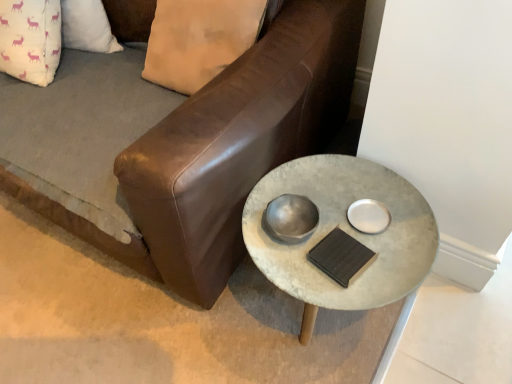
Question: Is concrete textured table at center wider than brown leather couch at center?

Choices:
 (A) no
 (B) yes

Answer: (A)

Question: Is concrete textured table at center facing away from brown leather couch at center?

Choices:
 (A) yes
 (B) no

Answer: (B)

Question: Is concrete textured table at center further to camera compared to brown leather couch at center?

Choices:
 (A) yes
 (B) no

Answer: (A)

Question: Is concrete textured table at center next to brown leather couch at center and touching it?

Choices:
 (A) no
 (B) yes

Answer: (A)

Question: From a real-world perspective, is concrete textured table at center positioned over brown leather couch at center based on gravity?

Choices:
 (A) no
 (B) yes

Answer: (B)

Question: From a real-world perspective, is concrete textured table at center positioned under brown leather couch at center based on gravity?

Choices:
 (A) no
 (B) yes

Answer: (A)

Question: Considering the relative sizes of brown leather couch at center and concrete textured table at center in the image provided, is brown leather couch at center smaller than concrete textured table at center?

Choices:
 (A) no
 (B) yes

Answer: (A)

Question: Is brown leather couch at center oriented towards concrete textured table at center?

Choices:
 (A) yes
 (B) no

Answer: (A)

Question: Can you confirm if brown leather couch at center is thinner than concrete textured table at center?

Choices:
 (A) no
 (B) yes

Answer: (A)

Question: Is brown leather couch at center positioned before concrete textured table at center?

Choices:
 (A) no
 (B) yes

Answer: (B)

Question: Is brown leather couch at center positioned beyond the bounds of concrete textured table at center?

Choices:
 (A) yes
 (B) no

Answer: (A)

Question: Is brown leather couch at center shorter than concrete textured table at center?

Choices:
 (A) no
 (B) yes

Answer: (B)

Question: Would you say concrete textured table at center is inside or outside brown leather couch at center?

Choices:
 (A) outside
 (B) inside

Answer: (A)